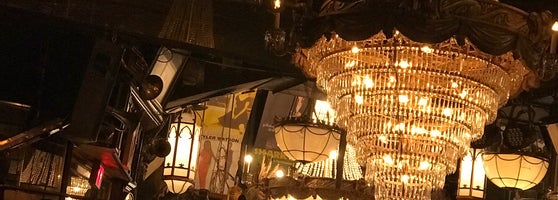
At what (x,y) coordinates should I click in order to perform the action: click on chandelier. Please return your answer as a coordinate pair (x, y). Looking at the image, I should click on click(477, 28), click(354, 25), click(360, 89), click(459, 112), click(420, 161), click(378, 140), click(83, 184), click(76, 190), click(351, 161), click(325, 107).